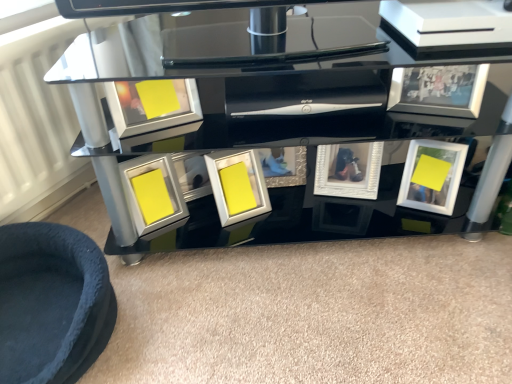
Find the location of `vacant region to the right of white glossy picture frame at center, arranged as the third picture frame when viewed from the left`. vacant region to the right of white glossy picture frame at center, arranged as the third picture frame when viewed from the left is located at coordinates (292, 210).